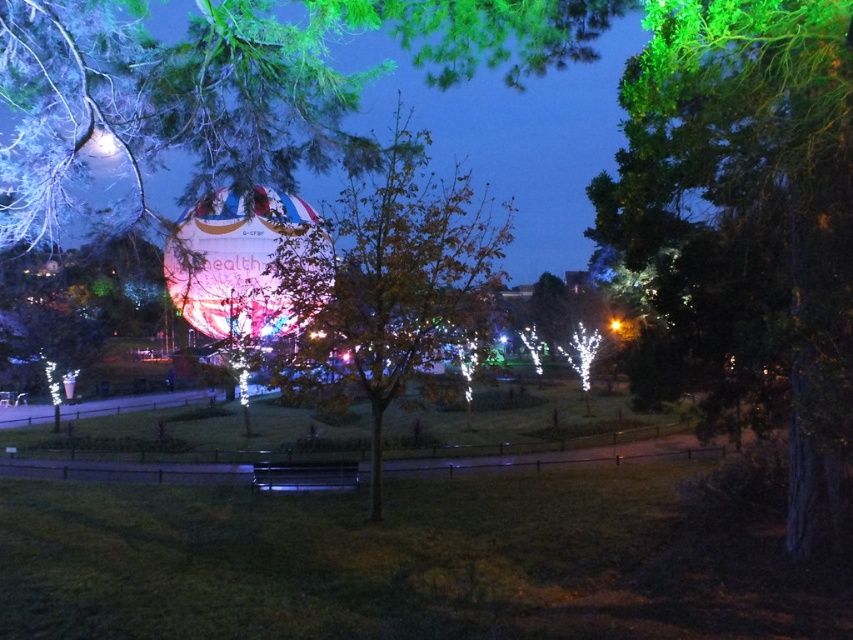
You are standing at the point marked by the coordinates point (747, 224). Looking around, you see the green leafy tree at right. Which direction should you face to see the hot air balloon in the midground?

The point (747, 224) is marked at the green leafy tree at right. To see the hot air balloon in the midground, you should face towards the center of the image where the balloon is located.